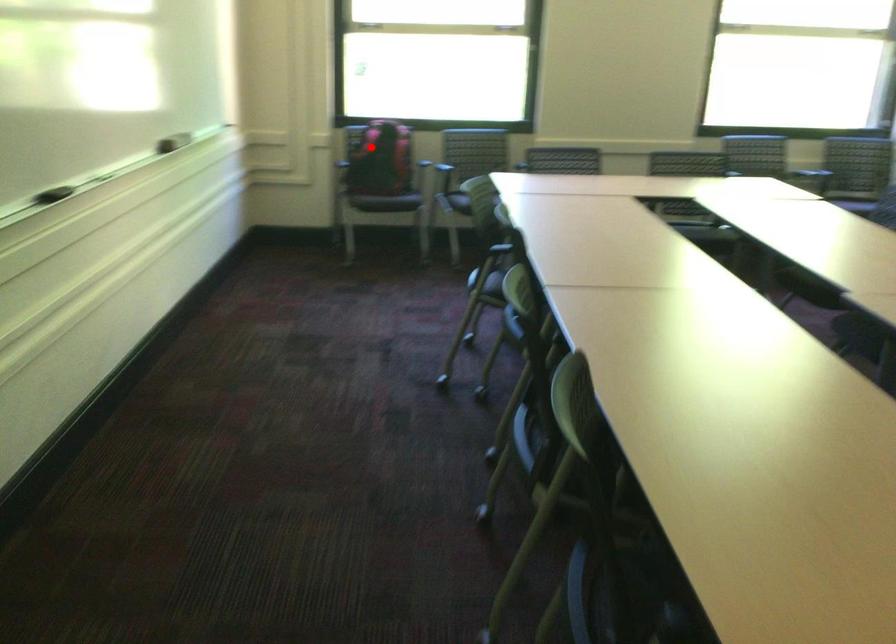
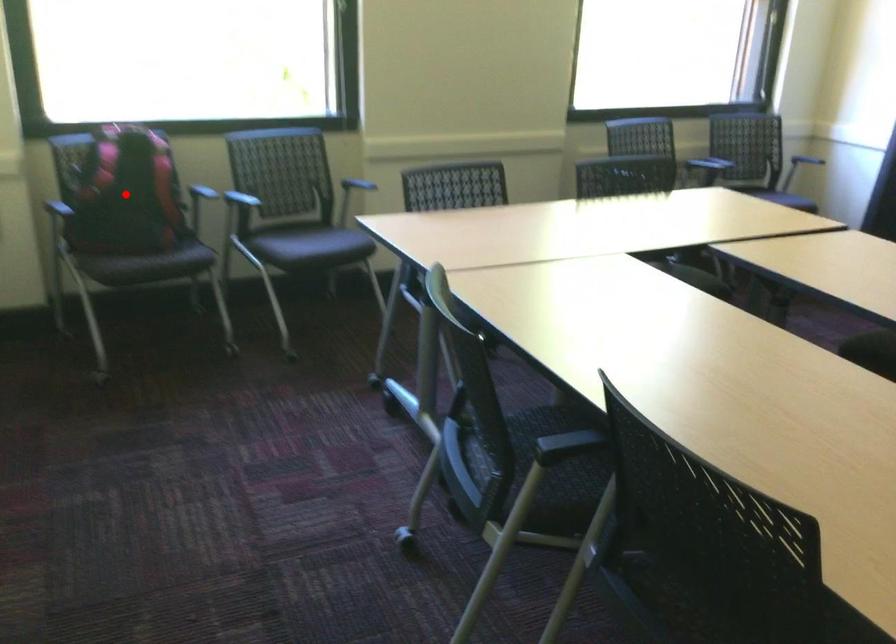
I am providing you with two images of the same scene from different viewpoints. A red point is marked on the first image and another point is marked on the second image. Are the points marked in image1 and image2 representing the same 3D position?

Yes